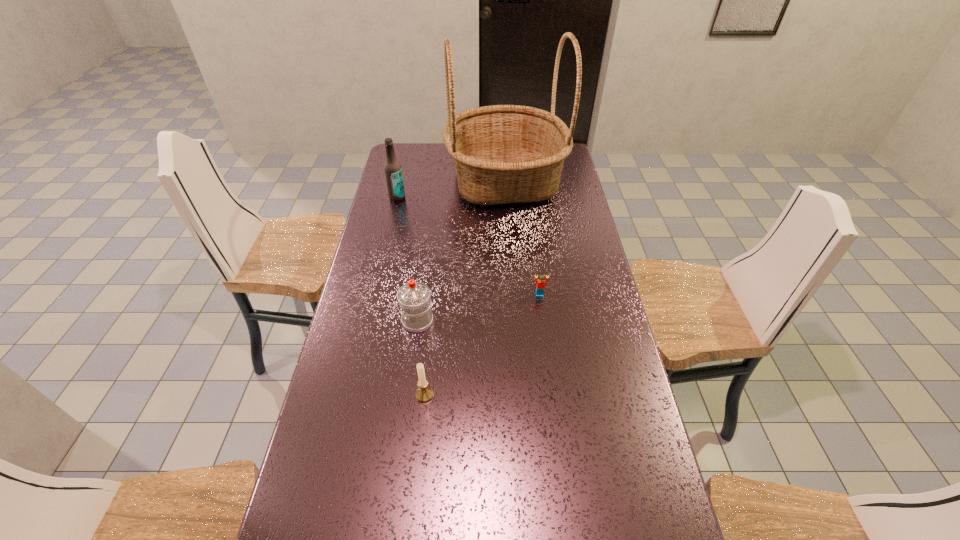
This screenshot has width=960, height=540. Identify the location of free space between the nearest object and the shortest object. (482, 345).

At what (x,y) coordinates should I click in order to perform the action: click on vacant region between the Lego and the fourth farthest object. Please return your answer as a coordinate pair (x, y). The width and height of the screenshot is (960, 540). Looking at the image, I should click on (478, 308).

At what (x,y) coordinates should I click in order to perform the action: click on free space between the tallest object and the second tallest object. Please return your answer as a coordinate pair (x, y). This screenshot has height=540, width=960. Looking at the image, I should click on (451, 190).

You are a GUI agent. You are given a task and a screenshot of the screen. Output one action in this format:
    pyautogui.click(x=<x>, y=<y>)
    Task: Click on the object that can be found as the closest to the basket
    This screenshot has width=960, height=540.
    Given the screenshot: What is the action you would take?
    pyautogui.click(x=393, y=172)

Locate which object ranks fourth in proximity to the beer bottle. Please provide its 2D coordinates. Your answer should be formatted as a tuple, i.e. [(x, y)], where the tuple contains the x and y coordinates of a point satisfying the conditions above.

[(424, 393)]

Identify the location of vacant area in the image that satisfies the following two spatial constraints: 1. on the front side of the basket; 2. on the handle side of the third tallest object. (516, 321).

Locate an element on the screen. This screenshot has height=540, width=960. free space that satisfies the following two spatial constraints: 1. on the face of the shortest object; 2. on the handle side of the third tallest object is located at coordinates (543, 321).

At what (x,y) coordinates should I click in order to perform the action: click on vacant space that satisfies the following two spatial constraints: 1. on the side of the second shortest object with the label; 2. on the left side of the fourth shortest object. Please return your answer as a coordinate pair (x, y). Looking at the image, I should click on (352, 395).